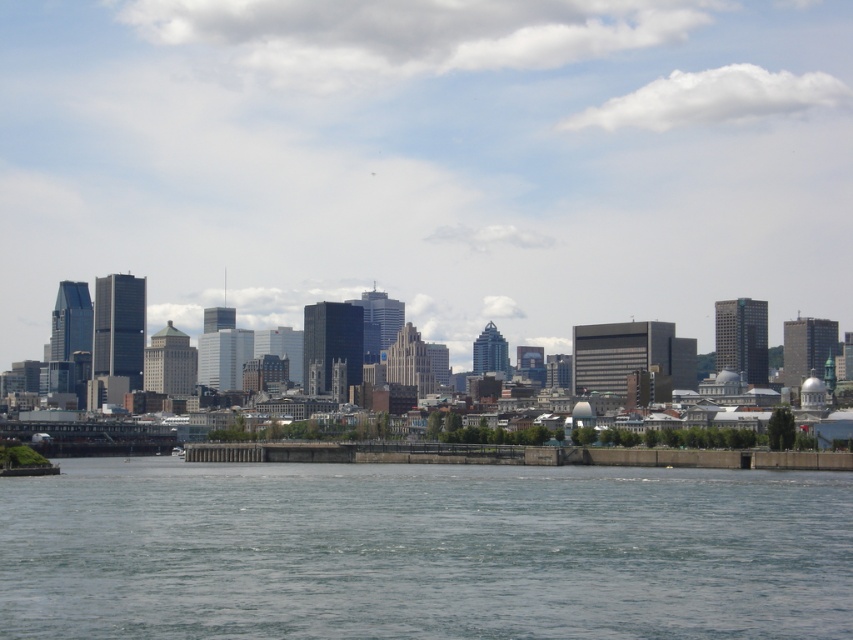
You are a drone operator who needs to fly a drone from the clear water at lower center to the matte glass buildings at center. Considering the height difference between them, will the drone need to ascend or descend to reach its destination?

The matte glass buildings at center is much taller than the clear water at lower center, so the drone will need to ascend to reach its destination.

You are a drone operator who needs to fly a drone from the clear water at lower center to the matte glass buildings at center. Given that the drone has a maximum flight range of 300 feet, will it be able to reach the buildings without needing to recharge?

The distance between the clear water at lower center and the matte glass buildings at center is 277.48 feet, which is within the drone operator drone has a maximum flight range of 300 feet. Therefore, the drone can successfully reach the matte glass buildings at center without needing to recharge.